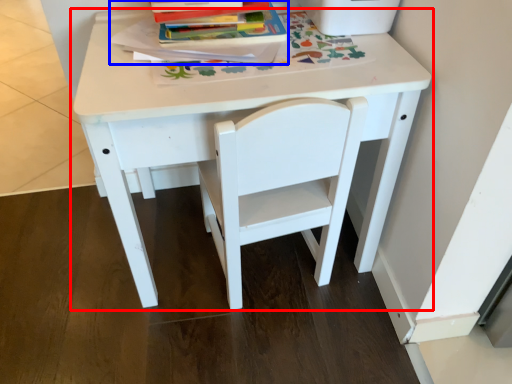
Question: Which of the following is the closest to the observer, table (highlighted by a red box) or paperback book (highlighted by a blue box)?

Choices:
 (A) table
 (B) paperback book

Answer: (A)